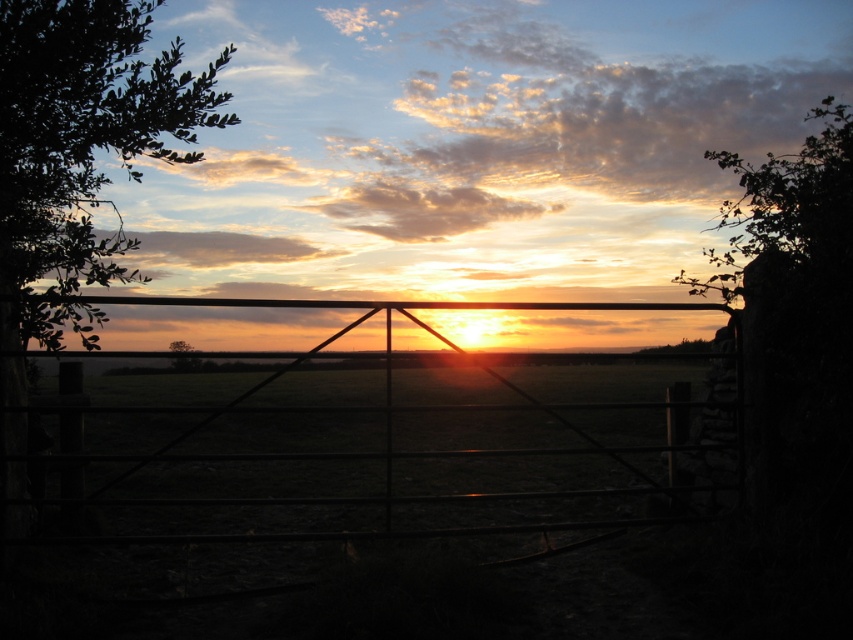
Question: Which point is farther to the camera?

Choices:
 (A) (229, 410)
 (B) (59, 248)
 (C) (698, 292)
 (D) (189, 344)

Answer: (C)

Question: Does green leafy tree at upper left have a greater width compared to green leafy tree at center?

Choices:
 (A) yes
 (B) no

Answer: (A)

Question: Which object appears farthest from the camera in this image?

Choices:
 (A) metallic gate at center
 (B) green leafy tree at upper left
 (C) green leafy tree at center
 (D) green leafy tree at upper right

Answer: (C)

Question: Based on their relative distances, which object is nearer to the metallic gate at center?

Choices:
 (A) green leafy tree at upper left
 (B) green leafy tree at upper right

Answer: (A)

Question: Is metallic gate at center to the left of green leafy tree at center from the viewer's perspective?

Choices:
 (A) no
 (B) yes

Answer: (A)

Question: Is green leafy tree at upper left further to camera compared to green leafy tree at center?

Choices:
 (A) yes
 (B) no

Answer: (B)